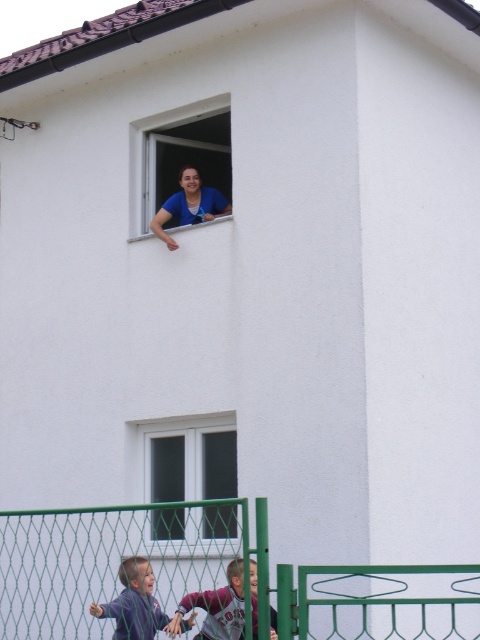
Consider the image. You are a delivery person trying to pass through the green wire mesh gate at lower center while carrying a large package. The package is as wide as the maroon jersey at lower center. Will the package fit through the gate?

The green wire mesh gate at lower center has a lesser width compared to the maroon jersey at lower center. Since the package is as wide as the maroon jersey at lower center, it will not fit through the gate.

You are a delivery person trying to reach the person at the open window. You see the green wire mesh gate at lower center and the maroon jersey at lower center. Which object is closer to the ground?

The maroon jersey at lower center is closer to the ground because the green wire mesh gate at lower center is above it.